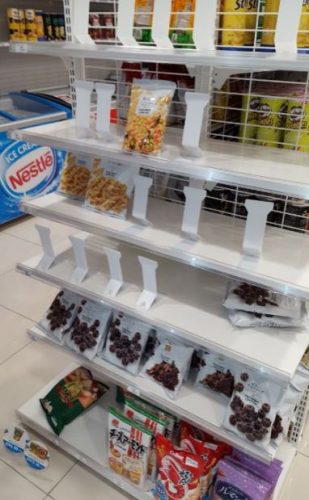
The image size is (309, 500). Identify the location of shelf wall. (33, 66).